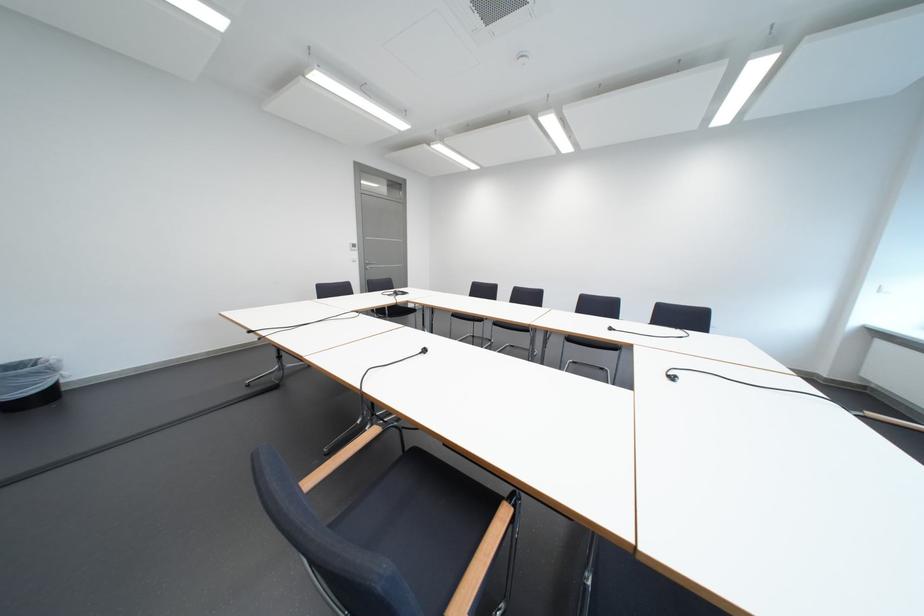
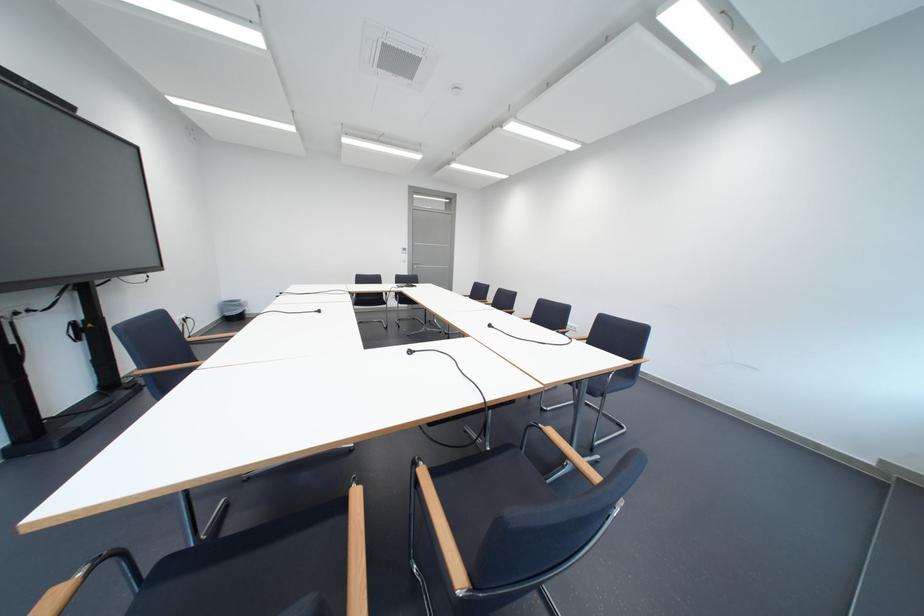
Question: I am providing you with two images of the same scene from different viewpoints. After the viewpoint changes to image2, which objects are now occluded?

Choices:
 (A) vertical door handle
 (B) wooden chair armrest
 (C) chair sitting surface
 (D) blue network jack

Answer: (B)